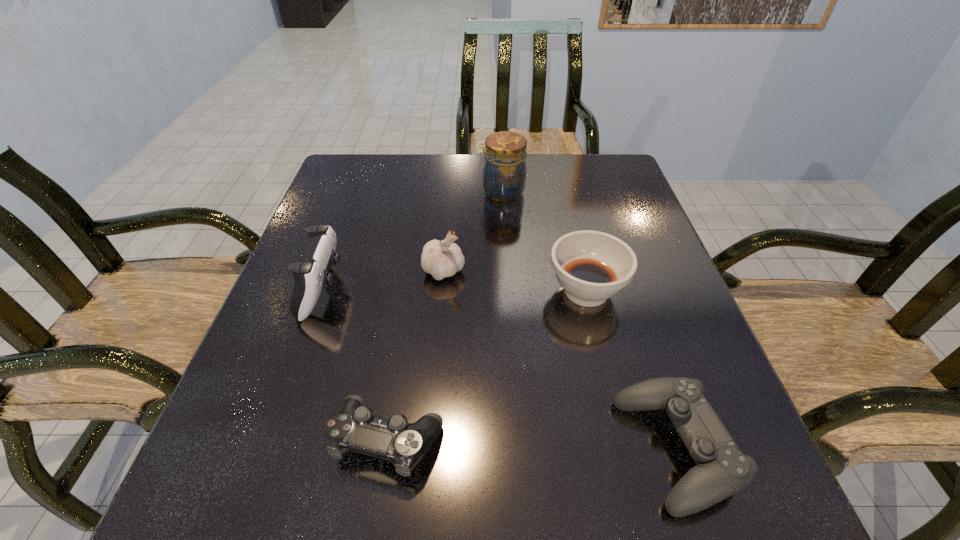
Locate an element on the screen. The image size is (960, 540). the farthest object is located at coordinates (504, 174).

Locate an element on the screen. the third object from right to left is located at coordinates (504, 174).

This screenshot has height=540, width=960. Find the location of `the tallest control`. the tallest control is located at coordinates pyautogui.click(x=310, y=275).

This screenshot has width=960, height=540. I want to click on the leftmost control, so click(x=310, y=275).

Find the location of a particular element. The height and width of the screenshot is (540, 960). garlic is located at coordinates (443, 259).

Find the location of `the fourth tallest object`. the fourth tallest object is located at coordinates (592, 266).

Locate an element on the screen. the second control from right to left is located at coordinates (352, 426).

You are a GUI agent. You are given a task and a screenshot of the screen. Output one action in this format:
    pyautogui.click(x=<x>, y=<y>)
    Task: Click on the rightmost control
    The image size is (960, 540).
    Given the screenshot: What is the action you would take?
    (722, 470)

This screenshot has width=960, height=540. Find the location of `vacant space located on the lid of the fourth object from left to right`. vacant space located on the lid of the fourth object from left to right is located at coordinates (346, 192).

You are a GUI agent. You are given a task and a screenshot of the screen. Output one action in this format:
    pyautogui.click(x=<x>, y=<y>)
    Task: Click on the free space located 0.360m on the lid of the fourth object from left to right
    
    Given the screenshot: What is the action you would take?
    pyautogui.click(x=346, y=192)